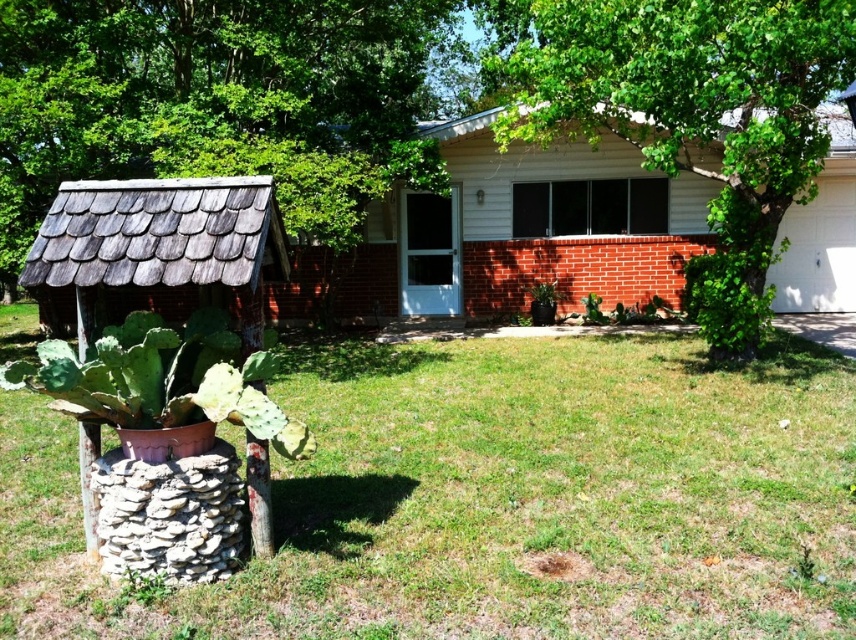
Does green leafy tree at left have a smaller size compared to green leafy tree at center?

Indeed, green leafy tree at left has a smaller size compared to green leafy tree at center.

What do you see at coordinates (221, 102) in the screenshot?
I see `green leafy tree at left` at bounding box center [221, 102].

Is point (107, 150) positioned behind point (730, 99)?

Yes, point (107, 150) is behind point (730, 99).

This screenshot has width=856, height=640. I want to click on green leafy tree at left, so click(x=221, y=102).

Can you confirm if green grass at lower center is thinner than green leafy tree at center?

Indeed, green grass at lower center has a lesser width compared to green leafy tree at center.

What do you see at coordinates (494, 499) in the screenshot? The image size is (856, 640). I see `green grass at lower center` at bounding box center [494, 499].

Image resolution: width=856 pixels, height=640 pixels. What do you see at coordinates (494, 499) in the screenshot?
I see `green grass at lower center` at bounding box center [494, 499].

At what (x,y) coordinates should I click in order to perform the action: click on green grass at lower center. Please return your answer as a coordinate pair (x, y). Image resolution: width=856 pixels, height=640 pixels. Looking at the image, I should click on (494, 499).

Between point (46, 593) and point (141, 141), which one is positioned behind?

The point (141, 141) is behind.

Which of these two, green grass at lower center or green leafy tree at left, stands taller?

green leafy tree at left is taller.

Which is in front, point (613, 444) or point (175, 150)?

Point (613, 444) is in front.

Locate an element on the screen. green grass at lower center is located at coordinates (x=494, y=499).